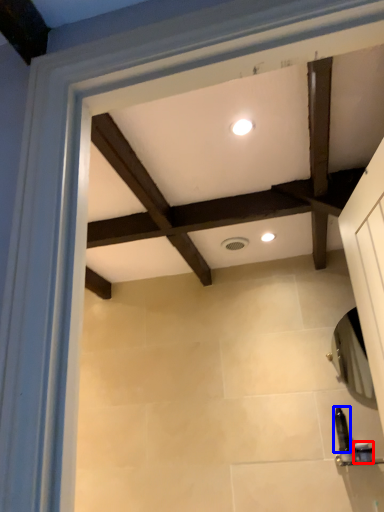
Question: Which of the following is the closest to the observer, toiletry (highlighted by a red box) or toiletry (highlighted by a blue box)?

Choices:
 (A) toiletry
 (B) toiletry

Answer: (A)